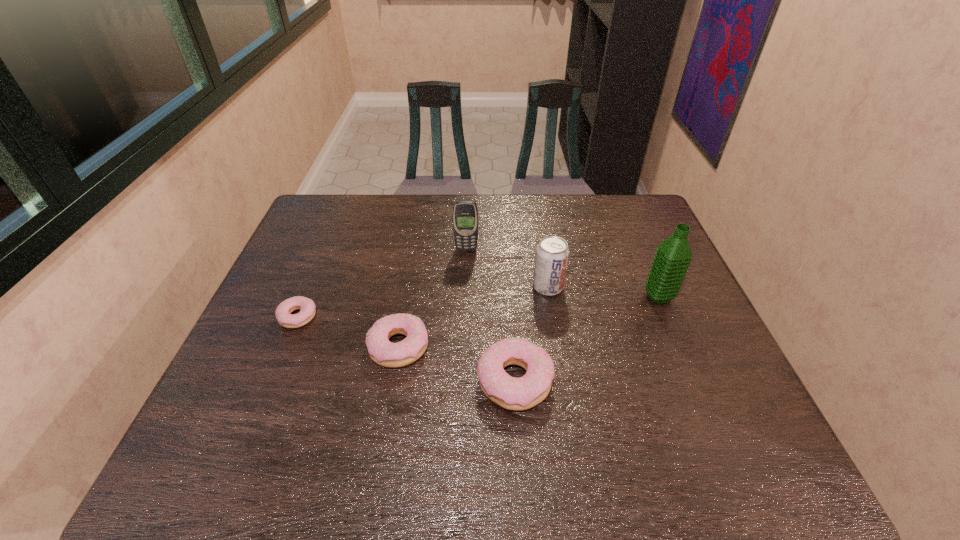
In the image, there is a desktop. Identify the location of vacant space at the left edge. coord(303,251).

In the image, there is a desktop. Where is `free region at the right edge`? free region at the right edge is located at coordinates (725, 384).

Find the location of a particular element. Image resolution: width=960 pixels, height=540 pixels. vacant point at the far left corner is located at coordinates (319, 213).

The width and height of the screenshot is (960, 540). Find the location of `free spot at the far right corner of the desktop`. free spot at the far right corner of the desktop is located at coordinates 599,200.

Locate an element on the screen. free point between the cellular telephone and the third tallest object is located at coordinates pos(507,268).

This screenshot has height=540, width=960. What are the coordinates of `vacant space in between the fourth shortest object and the farthest object` in the screenshot? It's located at (507, 268).

You are a GUI agent. You are given a task and a screenshot of the screen. Output one action in this format:
    pyautogui.click(x=<x>, y=<y>)
    Task: Click on the free space between the fifth tallest object and the shortest object
    The width and height of the screenshot is (960, 540).
    Given the screenshot: What is the action you would take?
    pyautogui.click(x=348, y=332)

At what (x,y) coordinates should I click in order to perform the action: click on free space that is in between the fourth shortest object and the leftmost object. Please return your answer as a coordinate pair (x, y). Looking at the image, I should click on (422, 302).

Where is `free spot between the tallest object and the soda can`? The image size is (960, 540). free spot between the tallest object and the soda can is located at coordinates (603, 292).

Locate an element on the screen. This screenshot has width=960, height=540. vacant area between the second doughnut from left to right and the rightmost doughnut is located at coordinates tap(457, 363).